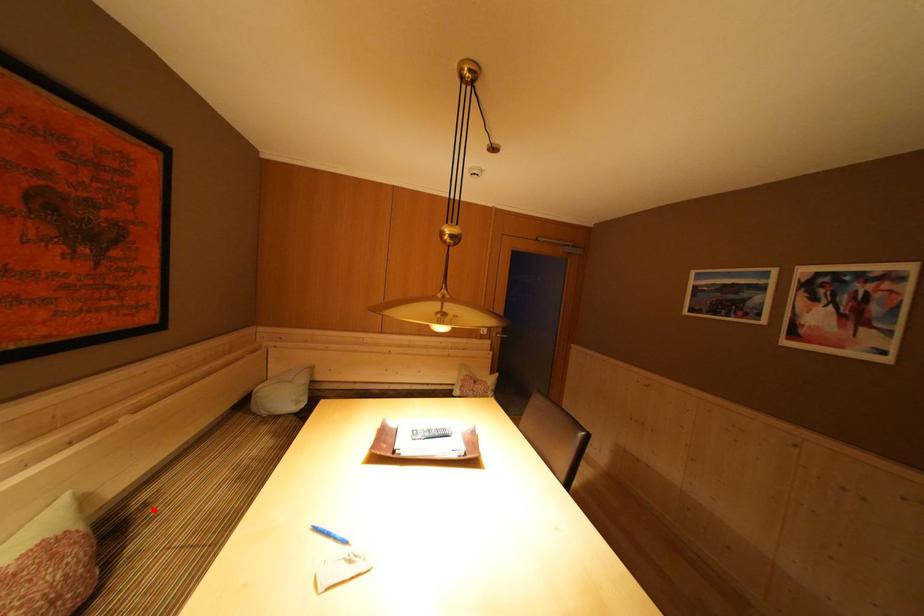
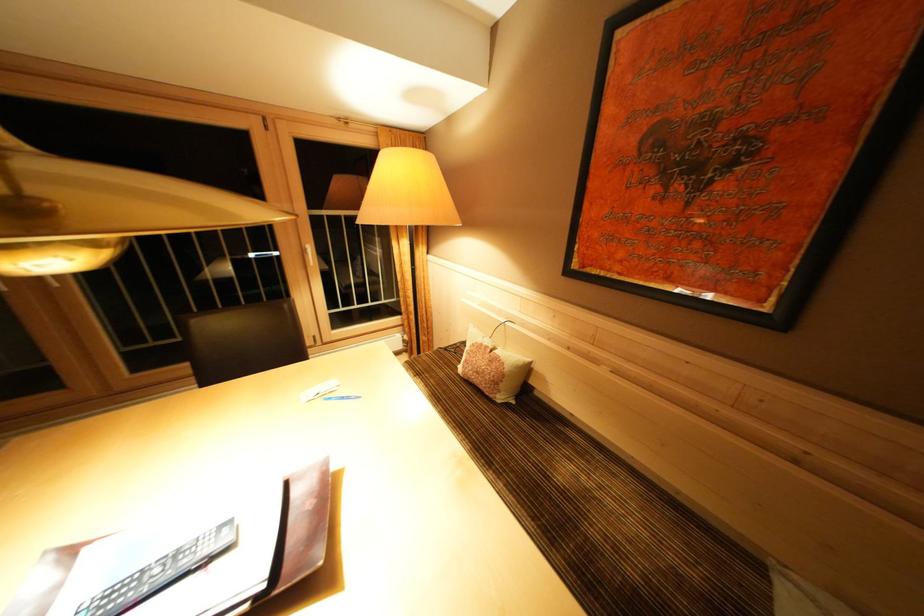
The point at the highlighted location is marked in the first image. Where is the corresponding point in the second image?

(565, 438)